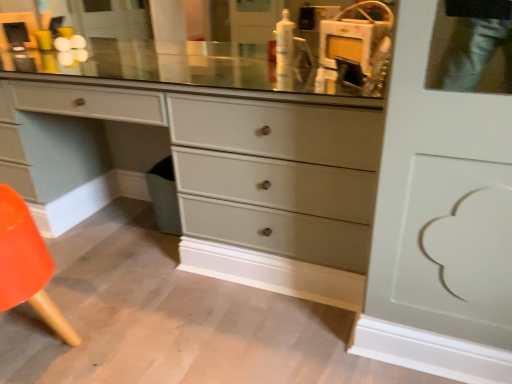
I want to click on vacant space underneath orange plastic chair at lower left (from a real-world perspective), so click(36, 339).